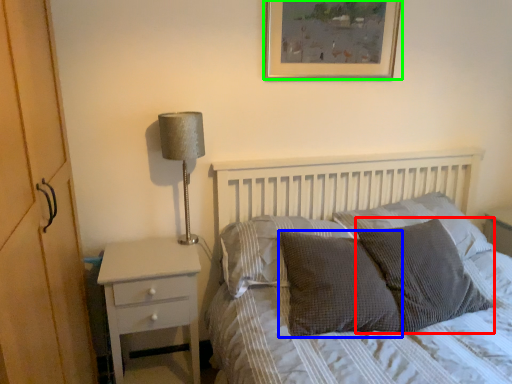
Question: Which object is the closest to the pillow (highlighted by a red box)? Choose among these: pillow (highlighted by a blue box) or picture frame (highlighted by a green box).

Choices:
 (A) pillow
 (B) picture frame

Answer: (A)